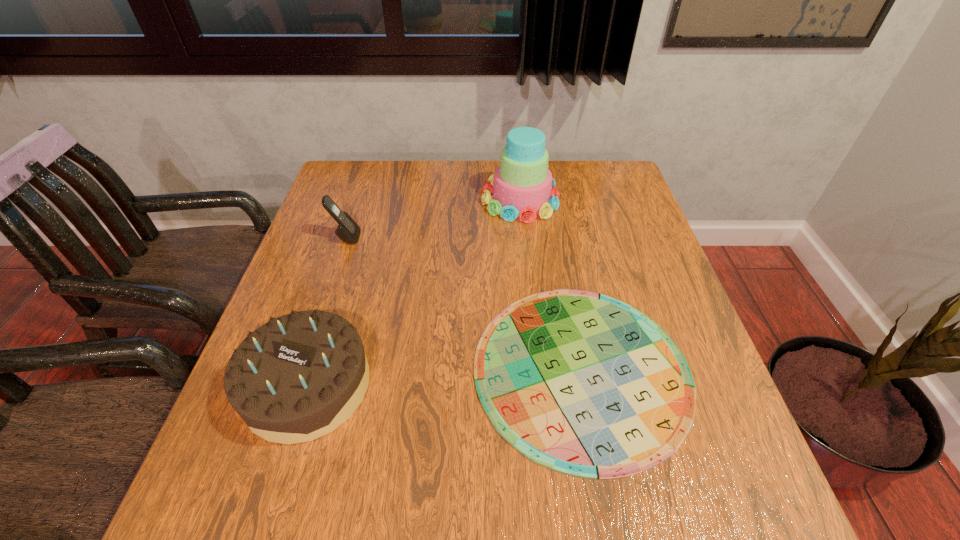
The width and height of the screenshot is (960, 540). I want to click on object that is at the near edge, so click(584, 384).

The height and width of the screenshot is (540, 960). Find the location of `cellular telephone positioned at the left edge`. cellular telephone positioned at the left edge is located at coordinates (347, 230).

Where is `birthday cake that is positioned at the left edge`? birthday cake that is positioned at the left edge is located at coordinates (298, 377).

Where is `object that is at the right edge`? object that is at the right edge is located at coordinates (584, 384).

This screenshot has height=540, width=960. I want to click on object present at the near right corner, so click(584, 384).

Find the location of `free region at the far edge`. free region at the far edge is located at coordinates (481, 188).

Locate an element on the screen. vacant space at the near edge of the desktop is located at coordinates (518, 481).

I want to click on free space at the left edge, so click(232, 445).

At what (x,y) coordinates should I click in order to perform the action: click on vacant space at the right edge of the desktop. Please return your answer as a coordinate pair (x, y). This screenshot has width=960, height=540. Looking at the image, I should click on (598, 250).

Where is `vacant area that lies between the cellular telephone and the gameboard`? The height and width of the screenshot is (540, 960). vacant area that lies between the cellular telephone and the gameboard is located at coordinates (464, 303).